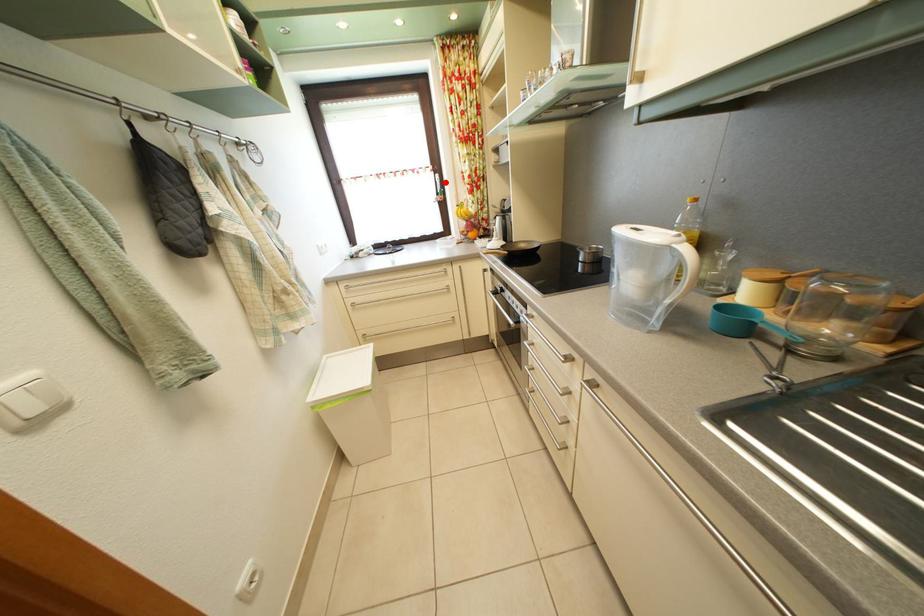
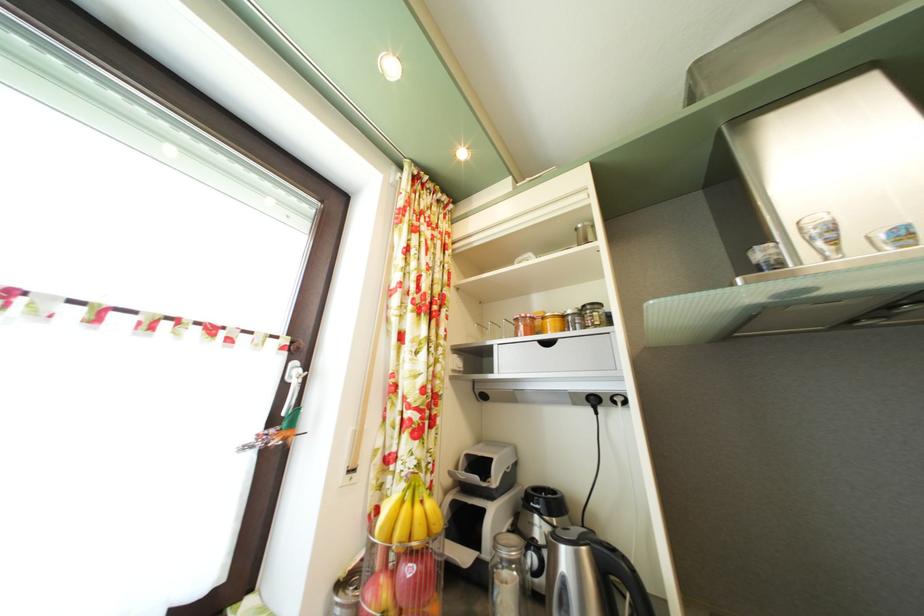
Question: I am providing you with two images of the same scene from different viewpoints. In image1, a red point is highlighted. Considering the same 3D point in image2, which of the following is correct?

Choices:
 (A) It is closer
 (B) It is farther

Answer: (B)